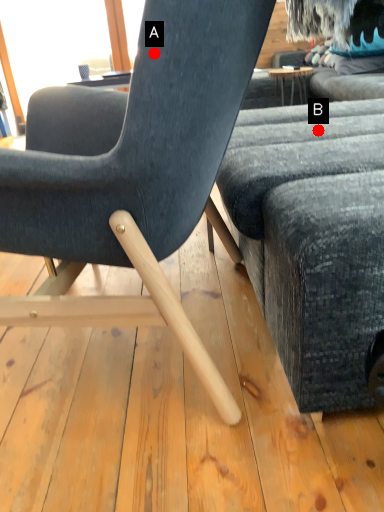
Question: Two points are circled on the image, labeled by A and B beside each circle. Which point is closer to the camera?

Choices:
 (A) A is closer
 (B) B is closer

Answer: (A)